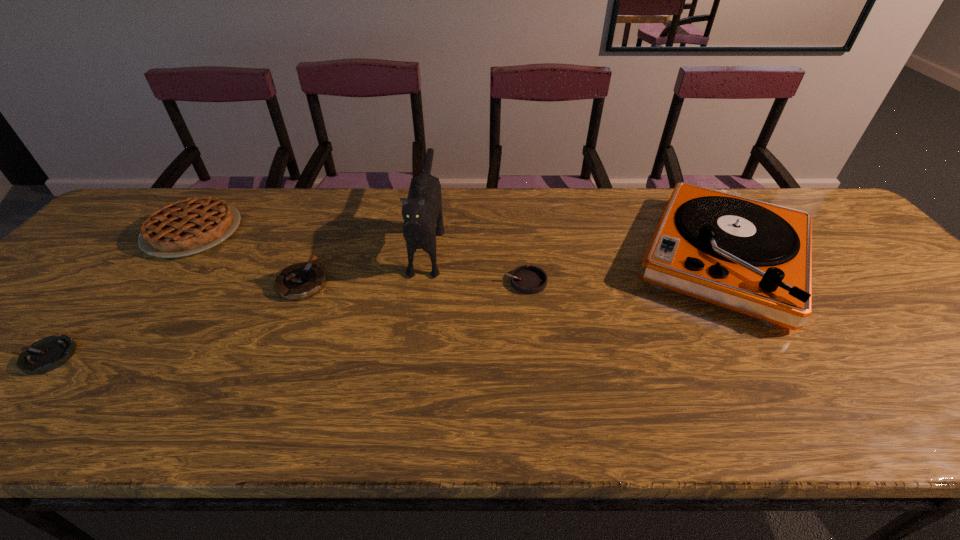
Locate an element on the screen. This screenshot has height=540, width=960. the nearest ashtray is located at coordinates (45, 355).

Find the location of a particular element. free space located on the front-facing side of the cat is located at coordinates (412, 354).

Find the location of a particular element. Image resolution: width=960 pixels, height=540 pixels. free region located on the front of the record player is located at coordinates (787, 362).

The width and height of the screenshot is (960, 540). In order to click on blank space located 0.390m on the right of the pie in this screenshot , I will do `click(374, 232)`.

You are a GUI agent. You are given a task and a screenshot of the screen. Output one action in this format:
    pyautogui.click(x=<x>, y=<y>)
    Task: Click on the free region located 0.380m on the back of the second ashtray from right to left
    The width and height of the screenshot is (960, 540).
    Given the screenshot: What is the action you would take?
    pyautogui.click(x=343, y=188)

You are a GUI agent. You are given a task and a screenshot of the screen. Output one action in this format:
    pyautogui.click(x=<x>, y=<y>)
    Task: Click on the free location located 0.140m on the front of the second object from right to left
    Image resolution: width=960 pixels, height=540 pixels.
    Given the screenshot: What is the action you would take?
    pyautogui.click(x=532, y=339)

You are a GUI agent. You are given a task and a screenshot of the screen. Output one action in this format:
    pyautogui.click(x=<x>, y=<y>)
    Task: Click on the vacant area situated 0.400m on the back of the nearest object
    The height and width of the screenshot is (540, 960).
    Given the screenshot: What is the action you would take?
    pyautogui.click(x=159, y=230)

Find the location of a particular element. cat at the far edge is located at coordinates (422, 210).

The image size is (960, 540). In order to click on record player that is at the far edge in this screenshot , I will do `click(753, 257)`.

Image resolution: width=960 pixels, height=540 pixels. Find the location of `pie that is positioned at the far edge`. pie that is positioned at the far edge is located at coordinates (189, 226).